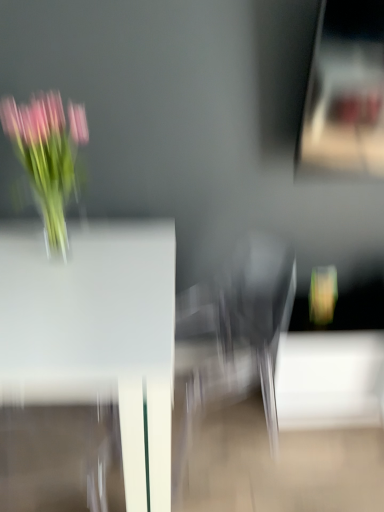
Describe the element at coordinates (96, 335) in the screenshot. Image resolution: width=384 pixels, height=512 pixels. I see `white glossy table at center` at that location.

Identify the location of white glossy table at center. Image resolution: width=384 pixels, height=512 pixels. 96,335.

In order to face pink glass vase at left, should I rotate leftwards or rightwards?

You should rotate left by 18.161 degrees.

The width and height of the screenshot is (384, 512). What do you see at coordinates (47, 156) in the screenshot? I see `pink glass vase at left` at bounding box center [47, 156].

This screenshot has height=512, width=384. I want to click on pink glass vase at left, so click(47, 156).

At what (x,y) coordinates should I click in order to perform the action: click on white glossy table at center. Please return your answer as a coordinate pair (x, y). The height and width of the screenshot is (512, 384). Looking at the image, I should click on (96, 335).

Which object is positioned more to the left, white glossy table at center or pink glass vase at left?

From the viewer's perspective, white glossy table at center appears more on the left side.

Is the depth of white glossy table at center greater than that of pink glass vase at left?

That is False.

Which is closer, (110, 398) or (58, 209)?

The point (110, 398) is closer to the camera.

From the image's perspective, which one is positioned higher, white glossy table at center or pink glass vase at left?

pink glass vase at left is shown above in the image.

From a real-world perspective, is white glossy table at center above or below pink glass vase at left?

Clearly, from a real-world perspective, white glossy table at center is below pink glass vase at left.

Which object is thinner, white glossy table at center or pink glass vase at left?

With smaller width is pink glass vase at left.

Does white glossy table at center have a lesser height compared to pink glass vase at left?

No, white glossy table at center is not shorter than pink glass vase at left.

Which of these two, white glossy table at center or pink glass vase at left, is smaller?

pink glass vase at left is smaller.

Is white glossy table at center completely or partially outside of pink glass vase at left?

That's correct, white glossy table at center is outside of pink glass vase at left.

Are white glossy table at center and pink glass vase at left far apart?

No, white glossy table at center is in close proximity to pink glass vase at left.

Is white glossy table at center facing away from pink glass vase at left?

white glossy table at center does not have its back to pink glass vase at left.

How different are the orientations of white glossy table at center and pink glass vase at left in degrees?

0.261 degrees.

Measure the distance between white glossy table at center and pink glass vase at left.

A distance of 14.12 inches exists between white glossy table at center and pink glass vase at left.

I want to click on floral arrangement located above the white glossy table at center (from the image's perspective), so click(47, 156).

Visually, is pink glass vase at left positioned to the left or to the right of white glossy table at center?

pink glass vase at left is to the right of white glossy table at center.

Which object is more forward, pink glass vase at left or white glossy table at center?

white glossy table at center.

Does point (33, 105) come farther from viewer compared to point (39, 320)?

Yes, it is behind point (39, 320).

From the image's perspective, who appears lower, pink glass vase at left or white glossy table at center?

From the image's view, white glossy table at center is below.

From a real-world perspective, who is located higher, pink glass vase at left or white glossy table at center?

From a 3D spatial view, pink glass vase at left is above.

In terms of width, does pink glass vase at left look wider or thinner when compared to white glossy table at center?

Considering their sizes, pink glass vase at left looks slimmer than white glossy table at center.

Considering the relative sizes of pink glass vase at left and white glossy table at center in the image provided, is pink glass vase at left taller than white glossy table at center?

Incorrect, the height of pink glass vase at left is not larger of that of white glossy table at center.

Who is smaller, pink glass vase at left or white glossy table at center?

pink glass vase at left is smaller.

Choose the correct answer: Is pink glass vase at left inside white glossy table at center or outside it?

pink glass vase at left is outside white glossy table at center.

Is pink glass vase at left in contact with white glossy table at center?

No.

Could you tell me if pink glass vase at left is facing white glossy table at center?

No, pink glass vase at left is not oriented towards white glossy table at center.

The width and height of the screenshot is (384, 512). Find the location of `table that appears below the pink glass vase at left (from the image's perspective)`. table that appears below the pink glass vase at left (from the image's perspective) is located at coordinates (96, 335).

Where is `floral arrangement above the white glossy table at center (from a real-world perspective)`? floral arrangement above the white glossy table at center (from a real-world perspective) is located at coordinates (47, 156).

You are a GUI agent. You are given a task and a screenshot of the screen. Output one action in this format:
    pyautogui.click(x=<x>, y=<y>)
    Task: Click on the table on the left of pink glass vase at left
    
    Given the screenshot: What is the action you would take?
    pyautogui.click(x=96, y=335)